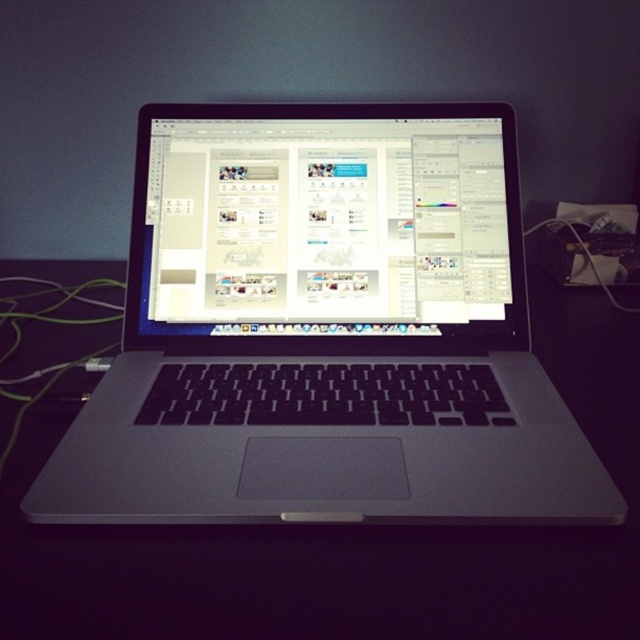
Question: Is black matte table at center smaller than satin silver laptop at center?

Choices:
 (A) no
 (B) yes

Answer: (A)

Question: Is sleek silver laptop at center to the right of black matte table at center from the viewer's perspective?

Choices:
 (A) no
 (B) yes

Answer: (B)

Question: Which point appears closest to the camera in this image?

Choices:
 (A) (339, 272)
 (B) (129, 612)
 (C) (492, 248)

Answer: (B)

Question: Does sleek silver laptop at center appear under satin silver laptop at center?

Choices:
 (A) yes
 (B) no

Answer: (A)

Question: Estimate the real-world distances between objects in this image. Which object is closer to the sleek silver laptop at center?

Choices:
 (A) black matte table at center
 (B) satin silver laptop at center

Answer: (B)

Question: Among these points, which one is farthest from the camera?

Choices:
 (A) (182, 172)
 (B) (76, 378)
 (C) (131, 304)

Answer: (A)